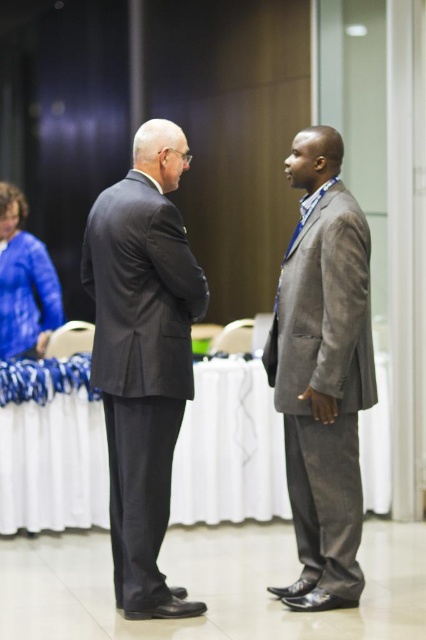
Does dark gray suit at center have a greater height compared to gray suit at center?

Incorrect, dark gray suit at center's height is not larger of gray suit at center's.

Which is below, dark gray suit at center or gray suit at center?

dark gray suit at center

The image size is (426, 640). What do you see at coordinates (143, 356) in the screenshot?
I see `dark gray suit at center` at bounding box center [143, 356].

Identify the location of dark gray suit at center. This screenshot has height=640, width=426. (143, 356).

What do you see at coordinates (322, 372) in the screenshot? I see `gray suit at center` at bounding box center [322, 372].

Which is more to the left, gray suit at center or blue fabric jacket at upper left?

From the viewer's perspective, blue fabric jacket at upper left appears more on the left side.

Is point (327, 572) positioned after point (31, 289)?

No.

This screenshot has height=640, width=426. Identify the location of gray suit at center. (322, 372).

Can you confirm if dark gray suit at center is shorter than blue fabric jacket at upper left?

In fact, dark gray suit at center may be taller than blue fabric jacket at upper left.

Which is below, dark gray suit at center or blue fabric jacket at upper left?

dark gray suit at center

Consider the image. Who is more distant from viewer, (129, 532) or (31, 241)?

The point (31, 241) is behind.

Where is `dark gray suit at center`? Image resolution: width=426 pixels, height=640 pixels. dark gray suit at center is located at coordinates (143, 356).